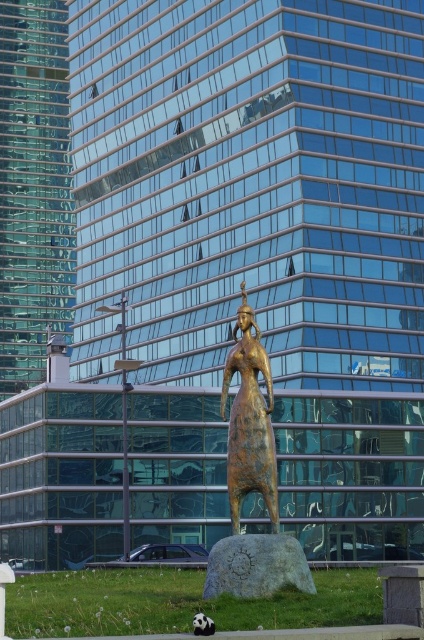
Question: Does bronze statue at center appear over rusty metallic statue at center?

Choices:
 (A) no
 (B) yes

Answer: (B)

Question: Which of the following is the farthest from the observer?

Choices:
 (A) bronze statue at center
 (B) rusty metallic statue at center

Answer: (A)

Question: Is bronze statue at center smaller than rusty metallic statue at center?

Choices:
 (A) yes
 (B) no

Answer: (B)

Question: Among these points, which one is farthest from the camera?

Choices:
 (A) (239, 460)
 (B) (262, 588)

Answer: (A)

Question: Can you confirm if bronze statue at center is thinner than rusty metallic statue at center?

Choices:
 (A) no
 (B) yes

Answer: (B)

Question: Which object appears farthest from the camera in this image?

Choices:
 (A) rusty metallic statue at center
 (B) bronze statue at center

Answer: (B)